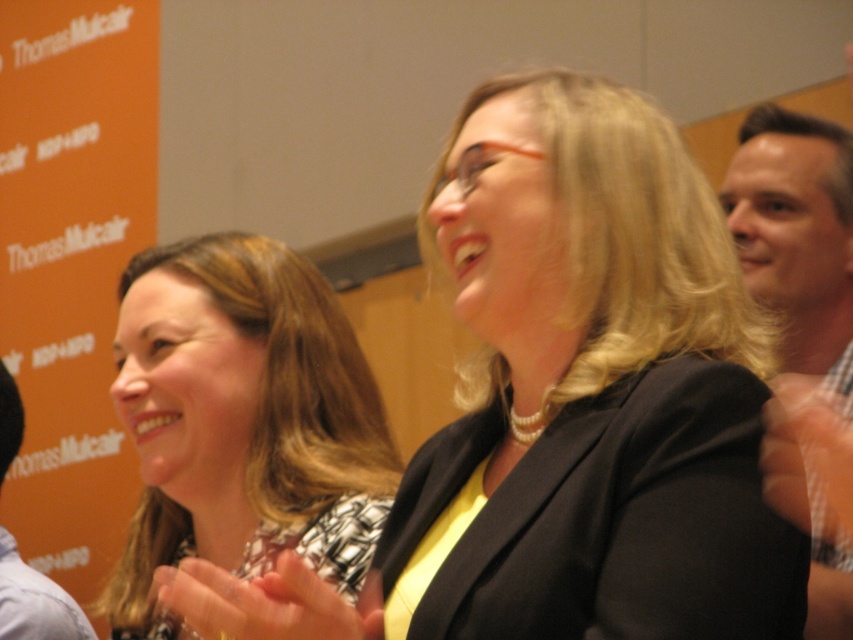
Is point (585, 304) more distant than point (347, 412)?

That is False.

Does point (595, 200) come closer to viewer compared to point (285, 330)?

Yes.

The width and height of the screenshot is (853, 640). Identify the location of black matte blazer at center. (570, 403).